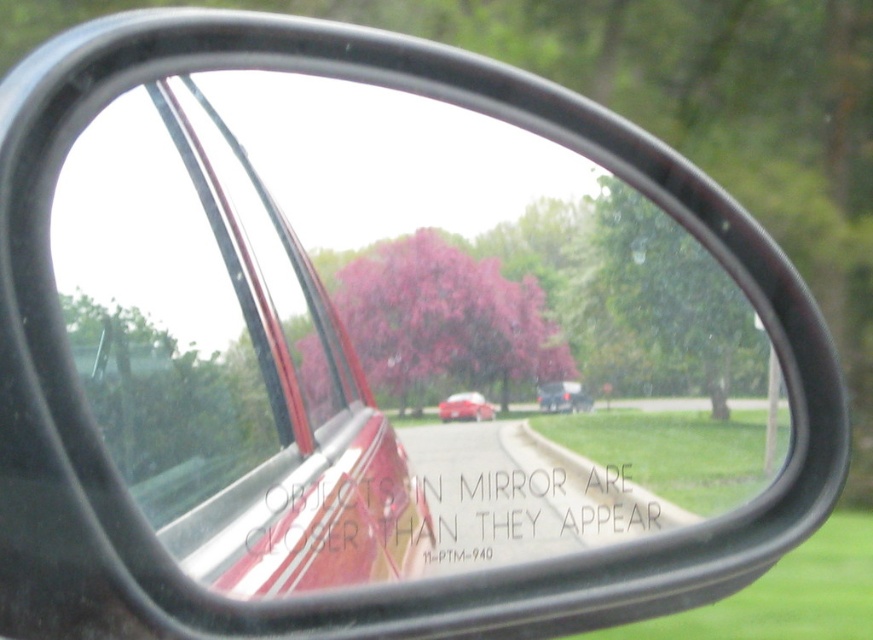
Which is in front, point (485, 536) or point (452, 403)?

Point (452, 403)

What do you see at coordinates (524, 515) in the screenshot? I see `white paper at center` at bounding box center [524, 515].

Locate an element on the screen. white paper at center is located at coordinates (524, 515).

Can you confirm if pink matte tree at center is bigger than matte black sedan at center?

Correct, pink matte tree at center is larger in size than matte black sedan at center.

Who is positioned more to the left, pink matte tree at center or matte black sedan at center?

Positioned to the left is pink matte tree at center.

Who is more distant from viewer, (478,296) or (538,404)?

The point (538,404) is more distant.

This screenshot has height=640, width=873. Find the location of `pink matte tree at center`. pink matte tree at center is located at coordinates (440, 317).

Does point (631, 522) come in front of point (571, 392)?

Yes, it is.

Which is behind, point (506, 532) or point (560, 385)?

The point (560, 385) is more distant.

Which is behind, point (449, 529) or point (552, 408)?

The point (552, 408) is behind.

The height and width of the screenshot is (640, 873). Find the location of `white paper at center`. white paper at center is located at coordinates (524, 515).